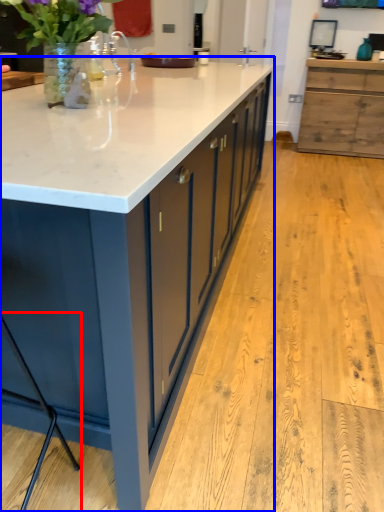
Question: Which object appears farthest to the camera in this image, bar stool (highlighted by a red box) or countertop (highlighted by a blue box)?

Choices:
 (A) bar stool
 (B) countertop

Answer: (B)